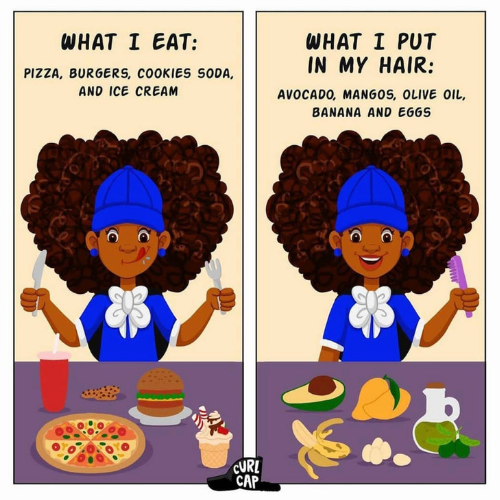
You are a GUI agent. You are given a task and a screenshot of the screen. Output one action in this format:
    pyautogui.click(x=<x>, y=<y>)
    Task: Click on the jar of olive oil
    
    Given the screenshot: What is the action you would take?
    pyautogui.click(x=422, y=428)